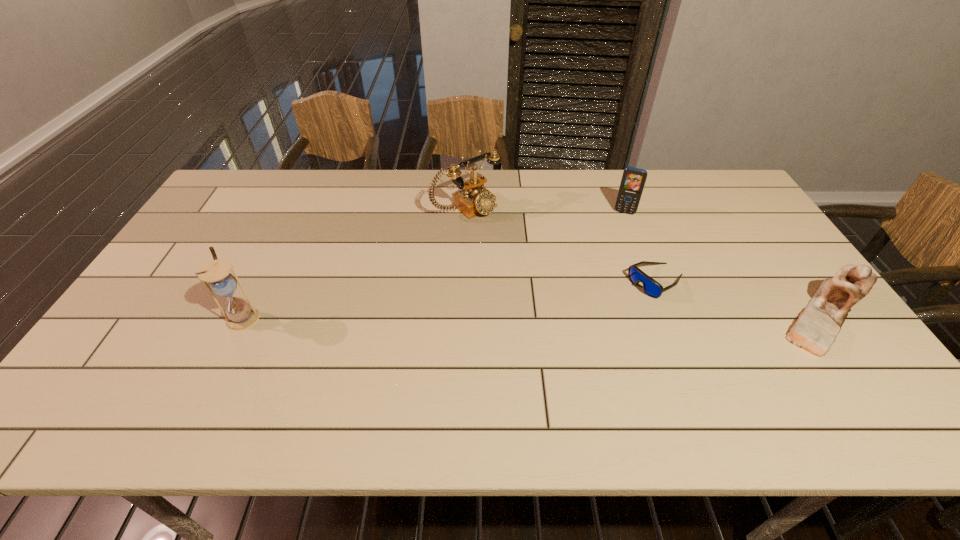
You are a GUI agent. You are given a task and a screenshot of the screen. Output one action in this format:
    pyautogui.click(x=<x>, y=<y>)
    Task: Click on the empty space that is in between the figurine and the shortest object
    The width and height of the screenshot is (960, 540).
    Given the screenshot: What is the action you would take?
    pyautogui.click(x=741, y=299)

Find the location of a particular element. Image resolution: width=960 pixels, height=540 pixels. unoccupied area between the cellular telephone and the sunglasses is located at coordinates (640, 247).

This screenshot has height=540, width=960. What are the coordinates of `blank region between the cellular telephone and the rightmost object` in the screenshot? It's located at (725, 264).

Identify the location of free space that is in between the sunglasses and the rightmost object. This screenshot has height=540, width=960. (741, 299).

At what (x,y) coordinates should I click in order to perform the action: click on vacant area that lies between the shortest object and the leftmost object. Please return your answer as a coordinate pair (x, y). Looking at the image, I should click on (450, 299).

This screenshot has height=540, width=960. Find the location of `free space between the cellular telephone and the hourglass`. free space between the cellular telephone and the hourglass is located at coordinates (434, 265).

I want to click on free space between the second object from left to right and the cellular telephone, so click(545, 210).

Identify the location of empty space that is in between the cellular telephone and the figurine. The height and width of the screenshot is (540, 960). (725, 264).

Identify which object is the fourth closest to the hourglass. Please provide its 2D coordinates. Your answer should be formatted as a tuple, i.e. [(x, y)], where the tuple contains the x and y coordinates of a point satisfying the conditions above.

[(815, 330)]

Identify which object is the second nearest to the telephone. Please provide its 2D coordinates. Your answer should be formatted as a tuple, i.e. [(x, y)], where the tuple contains the x and y coordinates of a point satisfying the conditions above.

[(651, 287)]